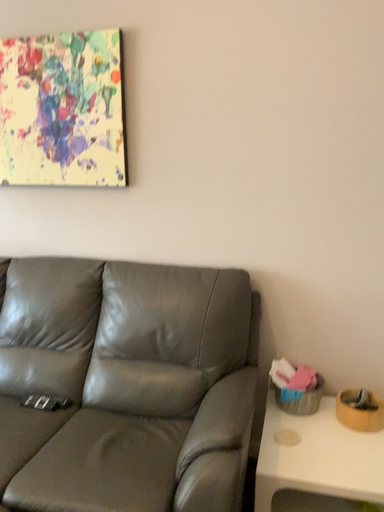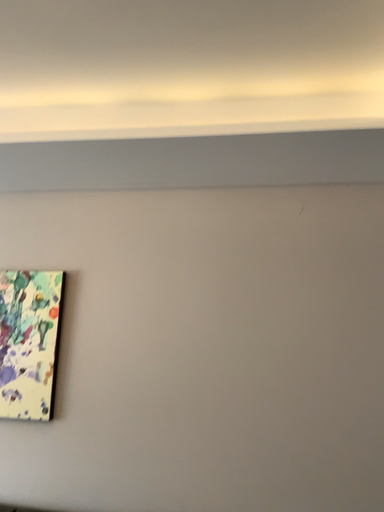
Question: Which way did the camera rotate in the video?

Choices:
 (A) rotated right
 (B) rotated left

Answer: (A)